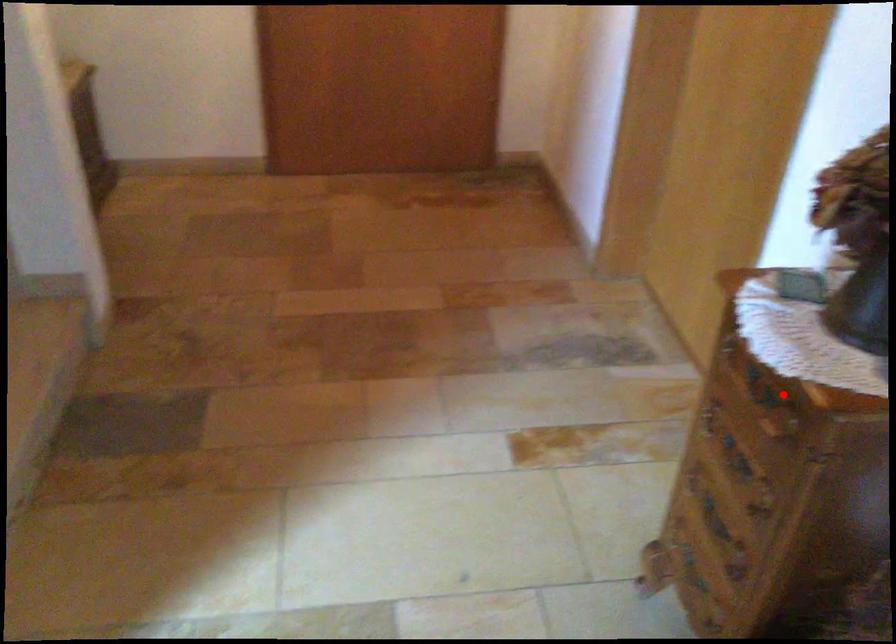
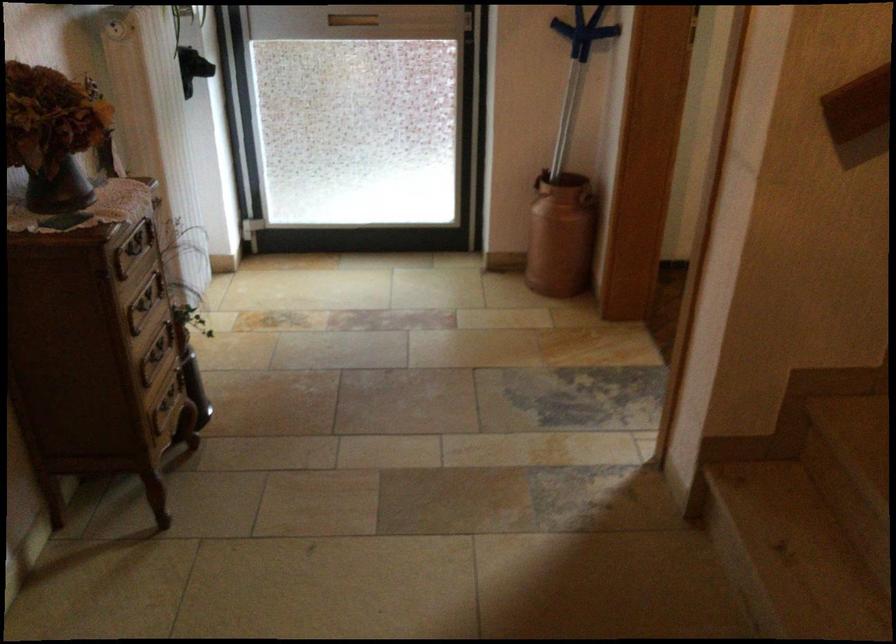
Question: I am providing you with two images of the same scene from different viewpoints. A red point is shown in image1. For the corresponding object point in image2, is it positioned nearer or farther from the camera?

Choices:
 (A) Nearer
 (B) Farther

Answer: (B)